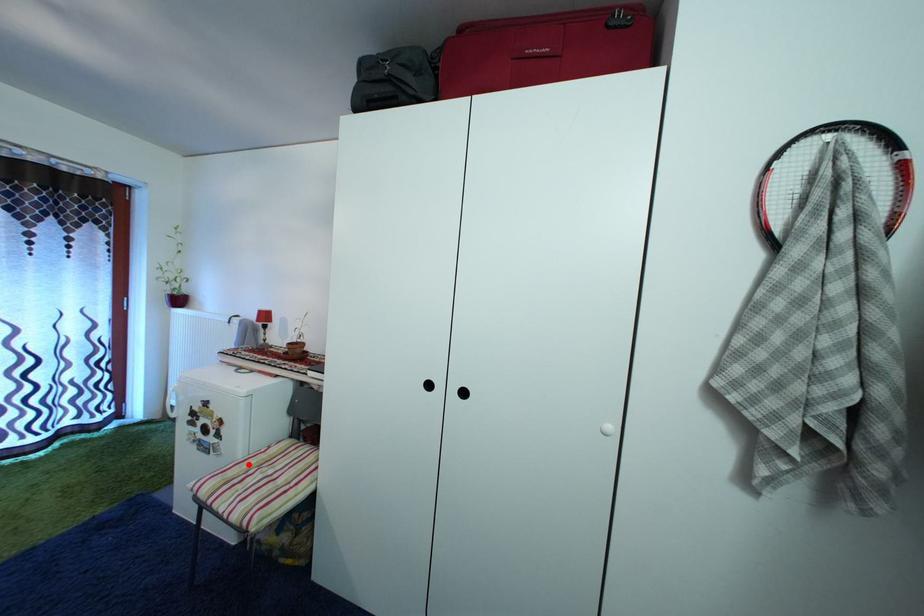
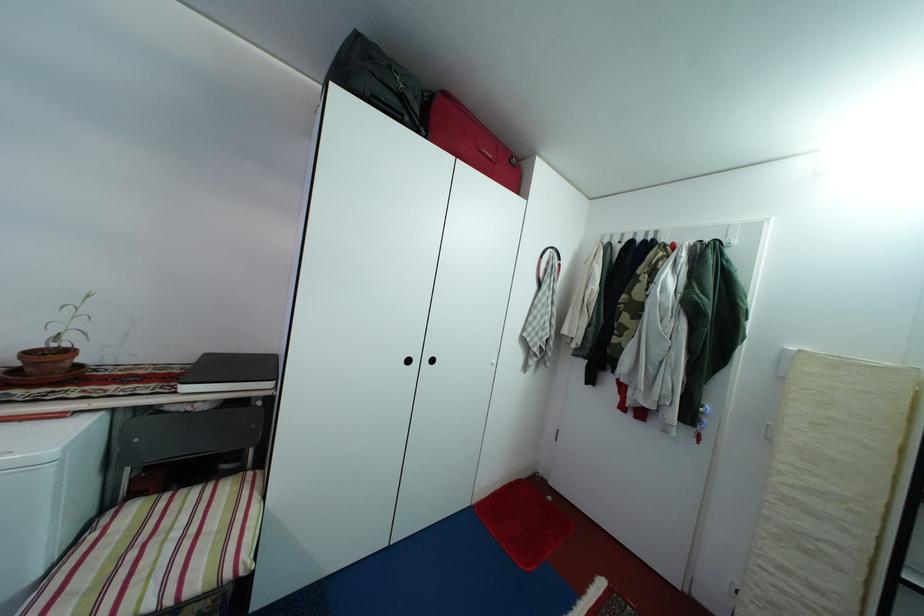
Find the pixel in the second image that matches the highlighted location in the first image.

(47, 581)